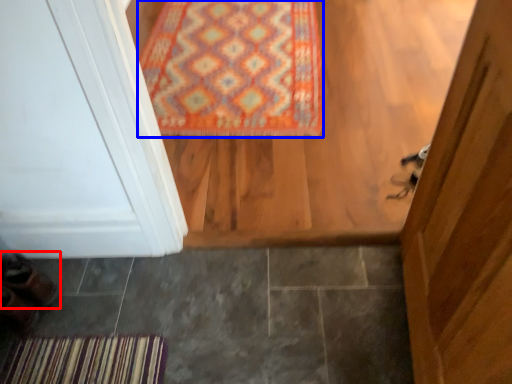
Question: Which of the following is the closest to the observer, shoe (highlighted by a red box) or mat (highlighted by a blue box)?

Choices:
 (A) shoe
 (B) mat

Answer: (A)